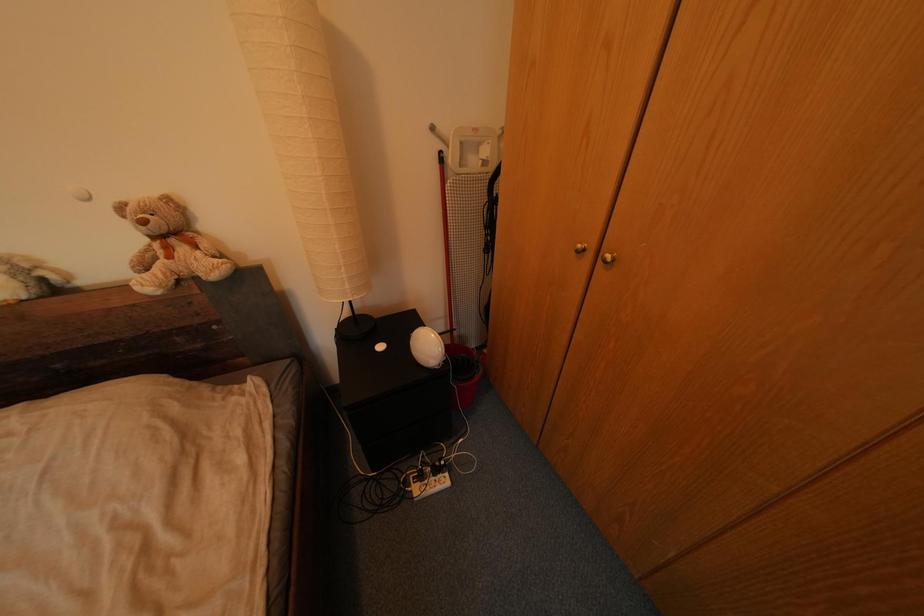
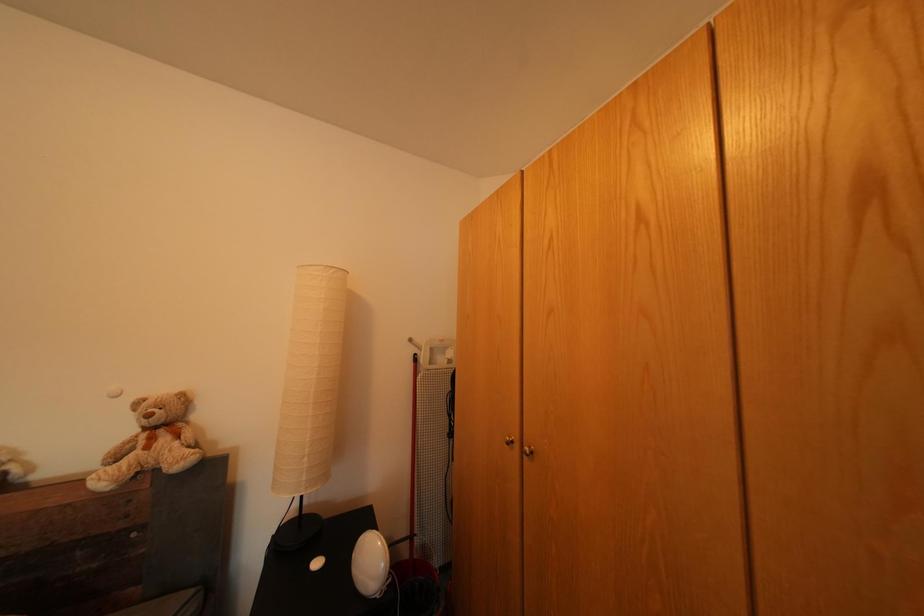
Question: The images are taken continuously from a first-person perspective. In which direction is your viewpoint rotating?

Choices:
 (A) Left
 (B) Right
 (C) Up
 (D) Down

Answer: (C)